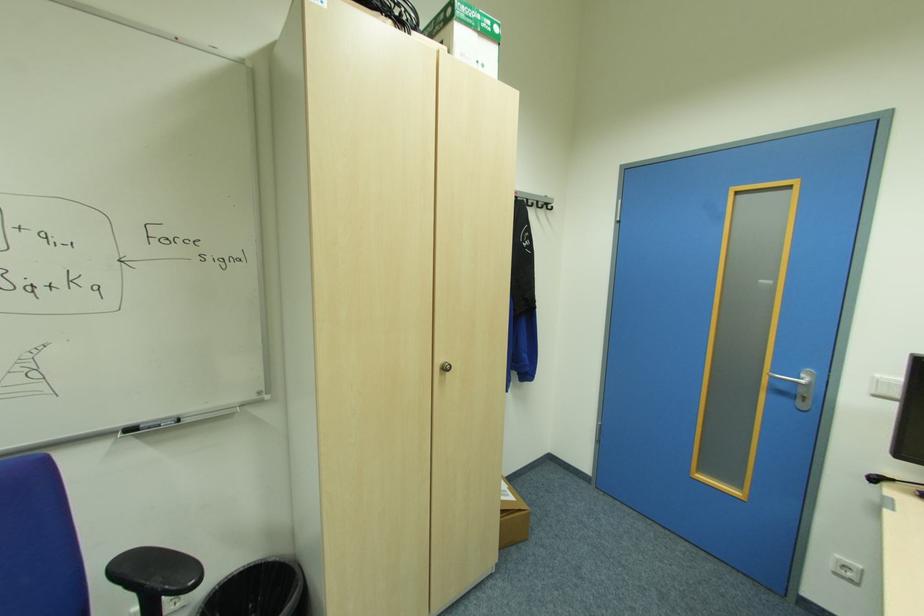
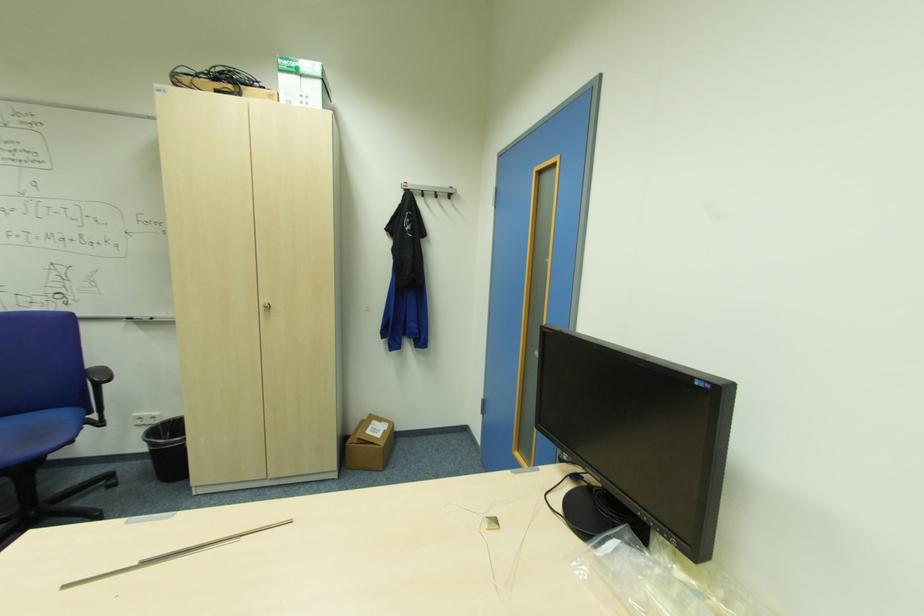
Locate, in the second image, the point that corresponds to pixel 540 201 in the first image.

(439, 192)